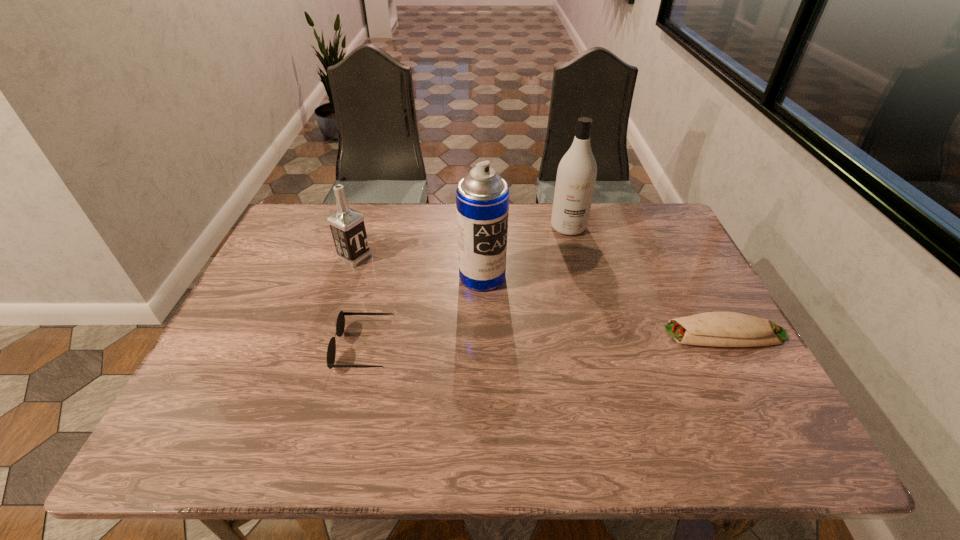
Locate an element on the screen. This screenshot has width=960, height=540. vacant position located at the bitten end of the shortest object is located at coordinates (616, 333).

Locate an element on the screen. The image size is (960, 540). free spot located at the bitten end of the shortest object is located at coordinates (612, 333).

Identify the location of vacant space positioned at the bitten end of the shortest object. The image size is (960, 540). (591, 333).

Find the location of `blank space located on the front label of the vodka`. blank space located on the front label of the vodka is located at coordinates (395, 277).

Locate an element on the screen. This screenshot has width=960, height=540. vacant space located 0.190m on the front label of the vodka is located at coordinates (417, 288).

The width and height of the screenshot is (960, 540). Identify the location of free spot located on the front label of the vodka. 420,289.

This screenshot has width=960, height=540. I want to click on free space located 0.400m on the label side of the third object from left to right, so click(622, 381).

Find the location of `free space located on the label side of the third object from left to right`. free space located on the label side of the third object from left to right is located at coordinates (579, 349).

Where is `vacant space located 0.170m on the label side of the third object from left to right`? This screenshot has width=960, height=540. vacant space located 0.170m on the label side of the third object from left to right is located at coordinates (544, 323).

Locate an element on the screen. The height and width of the screenshot is (540, 960). vacant space located 0.310m on the front-facing side of the farthest object is located at coordinates (577, 309).